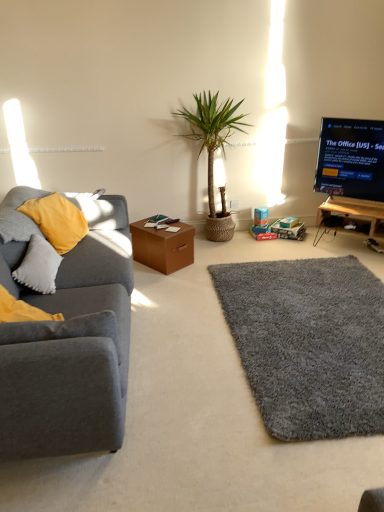
Question: Considering the relative sizes of gray shaggy rug at lower right and wooden tv stand at right in the image provided, is gray shaggy rug at lower right shorter than wooden tv stand at right?

Choices:
 (A) yes
 (B) no

Answer: (A)

Question: Does gray shaggy rug at lower right come in front of wooden tv stand at right?

Choices:
 (A) no
 (B) yes

Answer: (B)

Question: Is gray shaggy rug at lower right positioned behind wooden tv stand at right?

Choices:
 (A) no
 (B) yes

Answer: (A)

Question: Considering the relative positions of gray shaggy rug at lower right and wooden tv stand at right in the image provided, is gray shaggy rug at lower right to the left of wooden tv stand at right from the viewer's perspective?

Choices:
 (A) no
 (B) yes

Answer: (B)

Question: Considering the relative sizes of gray shaggy rug at lower right and wooden tv stand at right in the image provided, is gray shaggy rug at lower right thinner than wooden tv stand at right?

Choices:
 (A) no
 (B) yes

Answer: (A)

Question: Is gray shaggy rug at lower right in front of or behind brown cardboard box at center in the image?

Choices:
 (A) front
 (B) behind

Answer: (A)

Question: Which is correct: gray shaggy rug at lower right is inside brown cardboard box at center, or outside of it?

Choices:
 (A) outside
 (B) inside

Answer: (A)

Question: From their relative heights in the image, would you say gray shaggy rug at lower right is taller or shorter than brown cardboard box at center?

Choices:
 (A) tall
 (B) short

Answer: (B)

Question: Is gray shaggy rug at lower right bigger or smaller than brown cardboard box at center?

Choices:
 (A) small
 (B) big

Answer: (B)

Question: Is brown cardboard box at center wider or thinner than wooden tv stand at right?

Choices:
 (A) thin
 (B) wide

Answer: (B)

Question: Is brown cardboard box at center inside or outside of wooden tv stand at right?

Choices:
 (A) outside
 (B) inside

Answer: (A)

Question: Considering the positions of brown cardboard box at center and wooden tv stand at right in the image, is brown cardboard box at center bigger or smaller than wooden tv stand at right?

Choices:
 (A) big
 (B) small

Answer: (B)

Question: From a real-world perspective, relative to wooden tv stand at right, is brown cardboard box at center vertically above or below?

Choices:
 (A) above
 (B) below

Answer: (B)

Question: Do you think gray shaggy rug at lower right is within matte gray couch at left, or outside of it?

Choices:
 (A) outside
 (B) inside

Answer: (A)

Question: Looking at their shapes, would you say gray shaggy rug at lower right is wider or thinner than matte gray couch at left?

Choices:
 (A) wide
 (B) thin

Answer: (A)